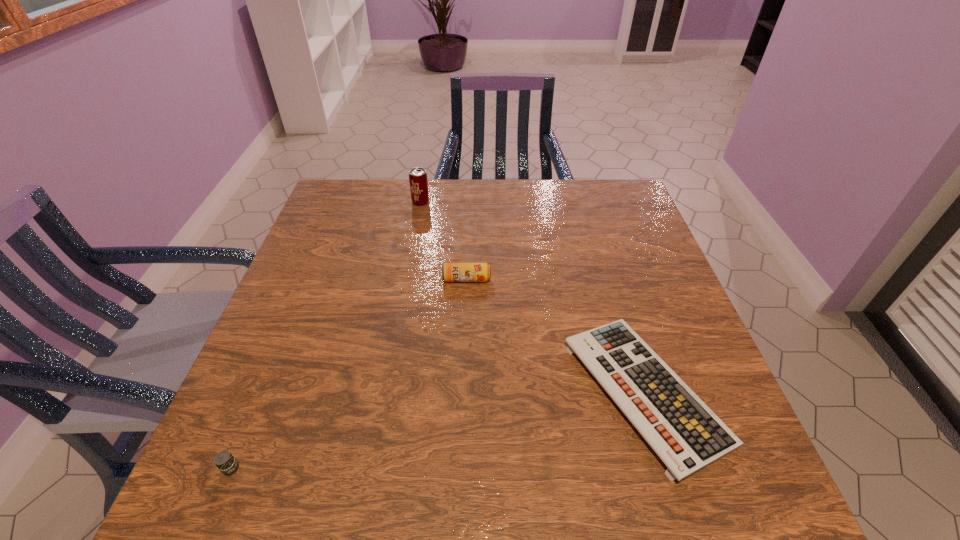
The width and height of the screenshot is (960, 540). I want to click on vacant point that satisfies the following two spatial constraints: 1. on the front side of the rightmost object; 2. on the left side of the second beer can from right to left, so click(x=387, y=392).